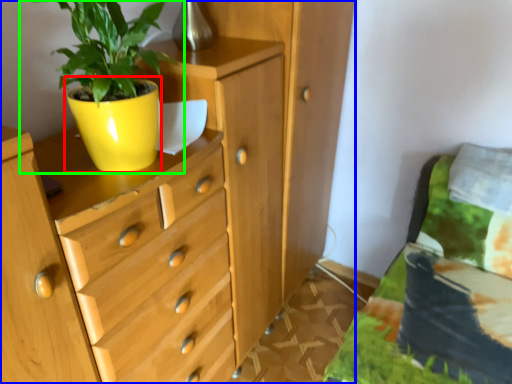
Question: Which object is positioned farthest from flowerpot (highlighted by a red box)? Select from chest of drawers (highlighted by a blue box) and houseplant (highlighted by a green box).

Choices:
 (A) chest of drawers
 (B) houseplant

Answer: (A)